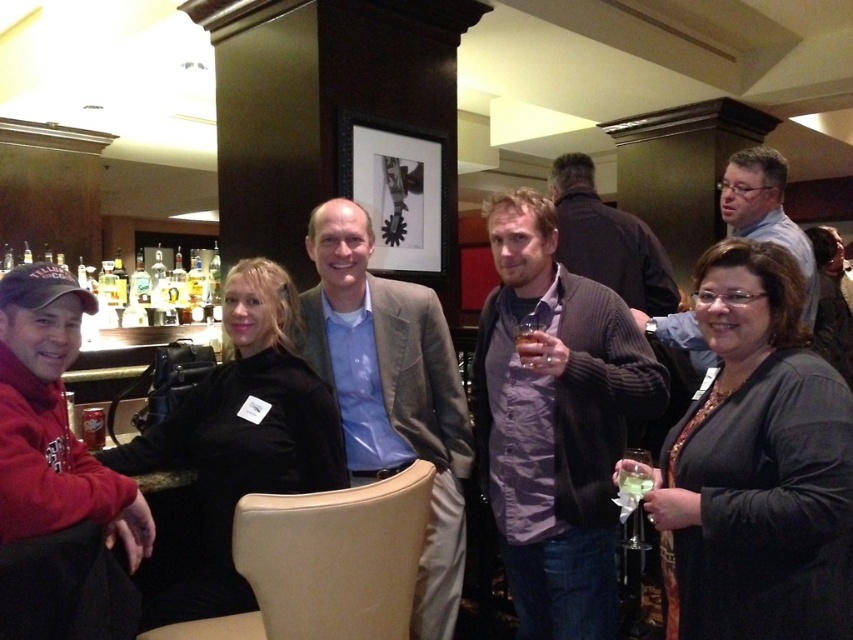
Between clear glass wine glass at lower center and clear glass at center, which one is positioned lower?

clear glass wine glass at lower center is below.

Can you confirm if clear glass wine glass at lower center is positioned to the left of clear glass at center?

No, clear glass wine glass at lower center is not to the left of clear glass at center.

Is point (637, 513) positioned in front of point (630, 493)?

No.

Find the location of a particular element. The image size is (853, 640). clear glass wine glass at lower center is located at coordinates (633, 496).

Can you confirm if knit sweater at center is smaller than matte gray shirt at center?

No, knit sweater at center is not smaller than matte gray shirt at center.

Can you confirm if knit sweater at center is taller than matte gray shirt at center?

Correct, knit sweater at center is much taller as matte gray shirt at center.

Does point (538, 577) lie behind point (740, 234)?

No.

Find the location of a particular element. This screenshot has width=853, height=640. knit sweater at center is located at coordinates (555, 422).

Which of these two, knit sweater at center or light brown textured blazer at center, stands shorter?

knit sweater at center

Does knit sweater at center have a greater width compared to light brown textured blazer at center?

In fact, knit sweater at center might be narrower than light brown textured blazer at center.

Does point (527, 593) come in front of point (373, 417)?

That is True.

Where is `knit sweater at center`? This screenshot has height=640, width=853. knit sweater at center is located at coordinates (555, 422).